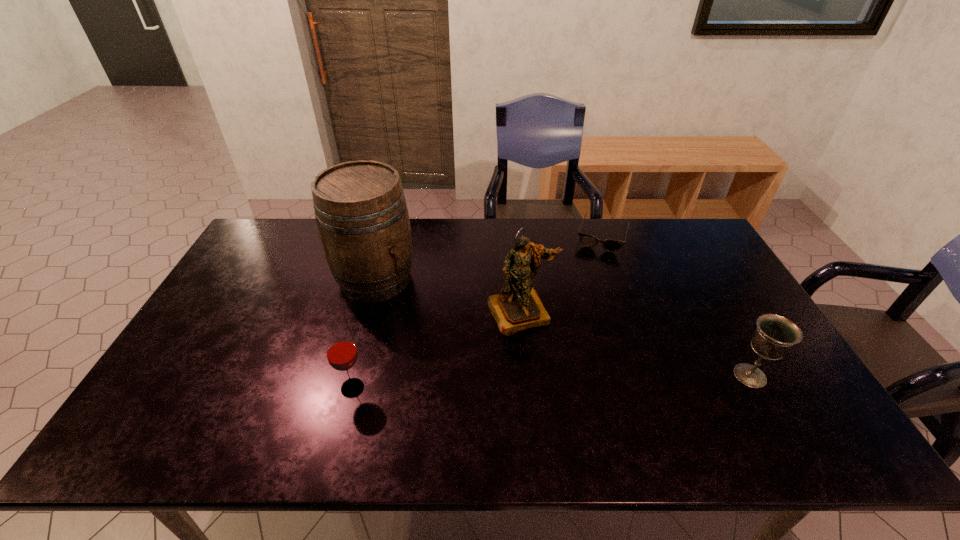
At what (x,y) coordinates should I click in order to perform the action: click on vacant space situated 0.330m on the side of the tallest object near the bung hole. Please return your answer as a coordinate pair (x, y). This screenshot has width=960, height=540. Looking at the image, I should click on (477, 359).

Where is `free region located 0.390m on the side of the tallest object near the bung hole`? The height and width of the screenshot is (540, 960). free region located 0.390m on the side of the tallest object near the bung hole is located at coordinates (493, 373).

Where is `vacant position located 0.240m on the front lenses of the shortest object`? vacant position located 0.240m on the front lenses of the shortest object is located at coordinates (585, 299).

Locate an element on the screen. The image size is (960, 540). free space located 0.120m on the front lenses of the shortest object is located at coordinates (591, 275).

The height and width of the screenshot is (540, 960). Find the location of `vacant area situated 0.050m on the front lenses of the shortest object`. vacant area situated 0.050m on the front lenses of the shortest object is located at coordinates (595, 262).

The image size is (960, 540). I want to click on vacant position located 0.220m on the front-facing side of the fourth shortest object, so click(564, 401).

At what (x,y) coordinates should I click in order to perform the action: click on free point located on the front-facing side of the fourth shortest object. Please return your answer as a coordinate pair (x, y). Looking at the image, I should click on 562,398.

At what (x,y) coordinates should I click in order to perform the action: click on vacant region located 0.180m on the front-facing side of the fourth shortest object. Please return your answer as a coordinate pair (x, y). This screenshot has width=960, height=540. Looking at the image, I should click on (557, 388).

Find the location of `cider positioned at the far edge`. cider positioned at the far edge is located at coordinates (361, 212).

At what (x,y) coordinates should I click in order to perform the action: click on sunglasses situated at the far edge. Please return your answer as a coordinate pair (x, y). The height and width of the screenshot is (540, 960). Looking at the image, I should click on (610, 245).